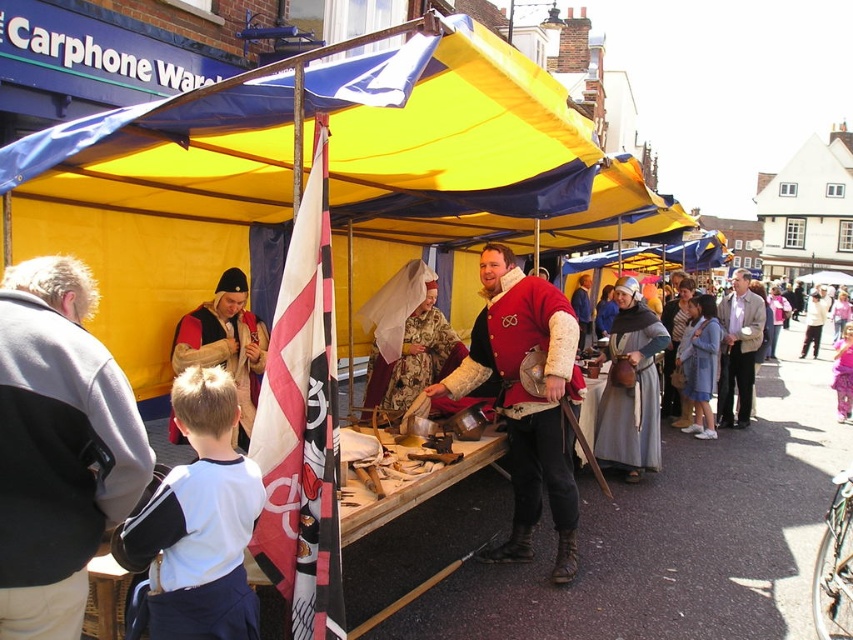
You are a visitor at this historical market and want to examine the matte red leather jacket at center closely. Considering the distance, can you walk up to it without needing to ask for permission?

The matte red leather jacket at center is 18.56 feet away from the camera, so you can easily walk up to it without needing to ask for permission since it is within a reasonable distance.

You are a visitor at the market and want to take a closer look at the floral fabric dress at center. If you walk straight towards it, how far will you have to walk to reach it?

The floral fabric dress at center is 7.72 meters away from the camera, so you will need to walk 7.72 meters to reach it.